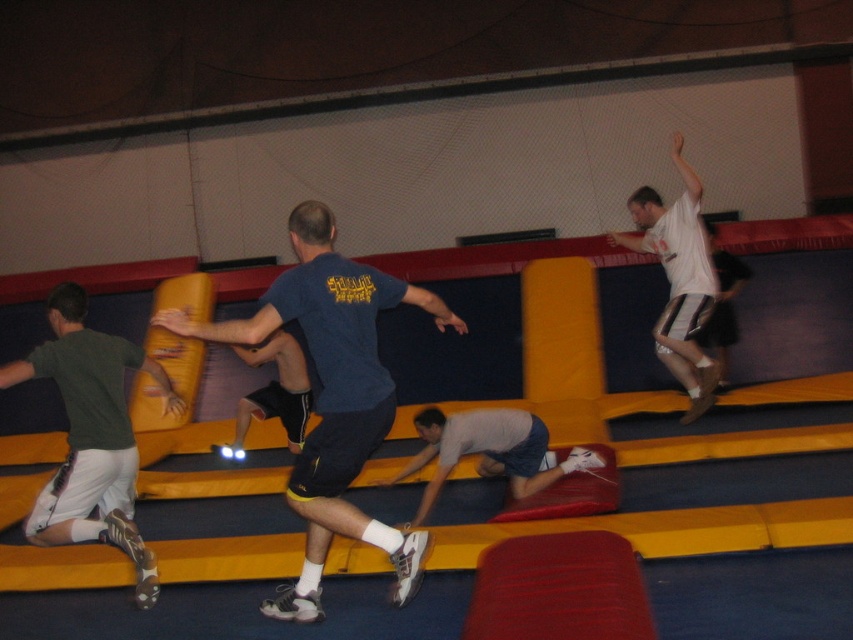
Locate an element on the screen. This screenshot has width=853, height=640. dark green jersey at left is located at coordinates (91, 435).

Is dark green jersey at left below dark blue shorts at center?

Indeed, dark green jersey at left is positioned under dark blue shorts at center.

Does point (103, 481) come in front of point (238, 400)?

Yes, it is.

Where is `dark green jersey at left`? dark green jersey at left is located at coordinates (91, 435).

Between point (640, 531) and point (228, 458), which one is positioned behind?

The point (228, 458) is more distant.

Who is more distant from viewer, (692, 467) or (279, 332)?

Positioned behind is point (692, 467).

You are a GUI agent. You are given a task and a screenshot of the screen. Output one action in this format:
    pyautogui.click(x=<x>, y=<y>)
    Task: Click on the yellow foam obstacle at center
    
    Given the screenshot: What is the action you would take?
    pyautogui.click(x=674, y=509)

Can you confirm if yellow foam obstacle at center is positioned below dark green jersey at left?

No.

Between yellow foam obstacle at center and dark green jersey at left, which one appears on the right side from the viewer's perspective?

yellow foam obstacle at center is more to the right.

Identify the location of yellow foam obstacle at center. The height and width of the screenshot is (640, 853). (674, 509).